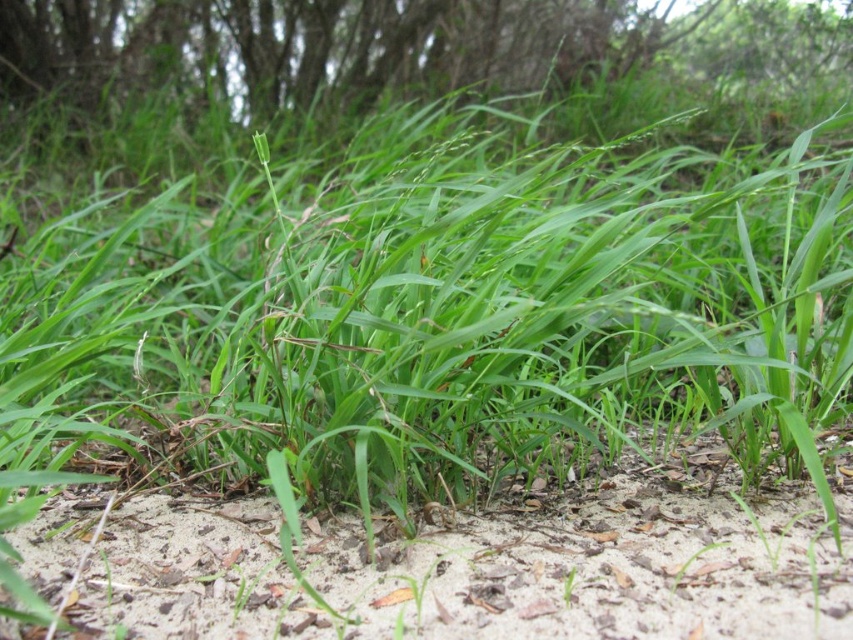
Question: Among these points, which one is nearest to the camera?

Choices:
 (A) pos(108,42)
 (B) pos(675,520)

Answer: (B)

Question: Where is light brown sandy soil at center located in relation to green grass at upper center in the image?

Choices:
 (A) below
 (B) above

Answer: (A)

Question: In this image, where is light brown sandy soil at center located relative to green grass at upper center?

Choices:
 (A) right
 (B) left

Answer: (A)

Question: Which of the following is the farthest from the observer?

Choices:
 (A) (398, 22)
 (B) (572, 515)

Answer: (A)

Question: Which point is farther to the camera?

Choices:
 (A) tap(509, 19)
 (B) tap(786, 506)

Answer: (A)

Question: Considering the relative positions of light brown sandy soil at center and green grass at upper center in the image provided, where is light brown sandy soil at center located with respect to green grass at upper center?

Choices:
 (A) right
 (B) left

Answer: (A)